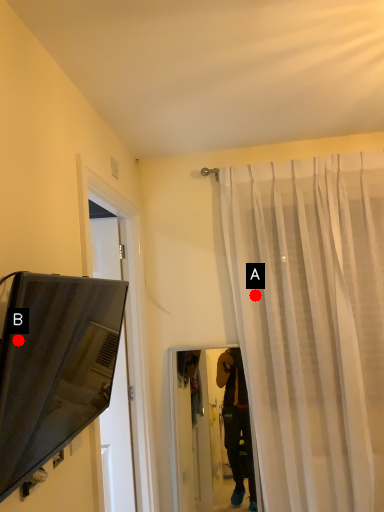
Question: Two points are circled on the image, labeled by A and B beside each circle. Which point is closer to the camera?

Choices:
 (A) A is closer
 (B) B is closer

Answer: (B)